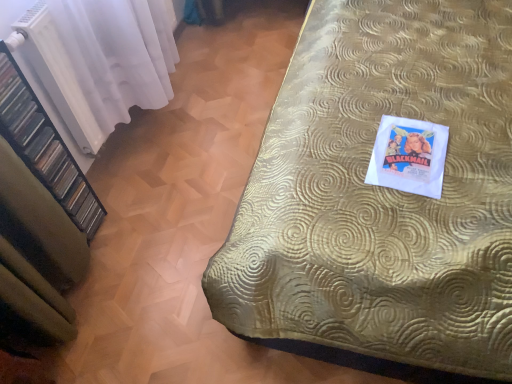
Measure the distance between white sheer curtain at left and camera.

white sheer curtain at left is 1.35 meters away from camera.

What do you see at coordinates (100, 60) in the screenshot? The width and height of the screenshot is (512, 384). I see `white sheer curtain at left` at bounding box center [100, 60].

Find the location of a particular element. This screenshot has height=384, width=512. black plastic shelf at left is located at coordinates (44, 147).

Does white sheer curtain at left have a greater width compared to gold textured bedspread at upper right?

No.

Is white sheer curtain at left placed right next to gold textured bedspread at upper right?

No, white sheer curtain at left is not making contact with gold textured bedspread at upper right.

Who is smaller, white sheer curtain at left or gold textured bedspread at upper right?

Smaller between the two is white sheer curtain at left.

Identify the location of bed below the white sheer curtain at left (from a real-world perspective). The image size is (512, 384). (382, 193).

In the scene shown: Considering the sizes of objects gold textured bedspread at upper right and white sheer curtain at left in the image provided, who is taller, gold textured bedspread at upper right or white sheer curtain at left?

With more height is white sheer curtain at left.

Is white sheer curtain at left a part of gold textured bedspread at upper right?

No, gold textured bedspread at upper right does not contain white sheer curtain at left.

Based on the photo, is gold textured bedspread at upper right wider than white sheer curtain at left?

Yes, gold textured bedspread at upper right is wider than white sheer curtain at left.

The image size is (512, 384). I want to click on curtain located on the left of gold textured bedspread at upper right, so click(100, 60).

Is black plastic shelf at left facing away from white sheer curtain at left?

That's not correct — black plastic shelf at left is not looking away from white sheer curtain at left.

Which object is positioned more to the left, black plastic shelf at left or white sheer curtain at left?

Positioned to the left is black plastic shelf at left.

Are black plastic shelf at left and white sheer curtain at left located far from each other?

That's not correct — black plastic shelf at left is a little close to white sheer curtain at left.

From the image's perspective, is white sheer curtain at left above or below black plastic shelf at left?

white sheer curtain at left is above black plastic shelf at left.

Based on the photo, can you tell me how much white sheer curtain at left and black plastic shelf at left differ in facing direction?

There is a 0.00177-degree angle between the facing directions of white sheer curtain at left and black plastic shelf at left.

Is white sheer curtain at left oriented away from black plastic shelf at left?

No, white sheer curtain at left's orientation is not away from black plastic shelf at left.

Where is `shelf that appears in front of the white sheer curtain at left`? The height and width of the screenshot is (384, 512). shelf that appears in front of the white sheer curtain at left is located at coordinates (44, 147).

Would you say black plastic shelf at left is to the left or to the right of gold textured bedspread at upper right in the picture?

Clearly, black plastic shelf at left is on the left of gold textured bedspread at upper right in the image.

From the image's perspective, is black plastic shelf at left located beneath gold textured bedspread at upper right?

Indeed, from the image's perspective, black plastic shelf at left is shown beneath gold textured bedspread at upper right.

Is black plastic shelf at left oriented towards gold textured bedspread at upper right?

No.

Considering the sizes of gold textured bedspread at upper right and black plastic shelf at left in the image, is gold textured bedspread at upper right wider or thinner than black plastic shelf at left?

Considering their sizes, gold textured bedspread at upper right looks broader than black plastic shelf at left.

From a real-world perspective, is gold textured bedspread at upper right physically below black plastic shelf at left?

Yes, from a real-world perspective, gold textured bedspread at upper right is below black plastic shelf at left.

Could you tell me if gold textured bedspread at upper right is turned towards black plastic shelf at left?

No, gold textured bedspread at upper right is not oriented towards black plastic shelf at left.

Is gold textured bedspread at upper right further to camera compared to black plastic shelf at left?

Yes, it is.

I want to click on bed on the right of white sheer curtain at left, so click(382, 193).

The image size is (512, 384). Find the location of `bed beneath the white sheer curtain at left (from a real-world perspective)`. bed beneath the white sheer curtain at left (from a real-world perspective) is located at coordinates (382, 193).

Consider the image. When comparing their distances from black plastic shelf at left, does gold textured bedspread at upper right or white sheer curtain at left seem closer?

white sheer curtain at left.

Estimate the real-world distances between objects in this image. Which object is further from gold textured bedspread at upper right, white sheer curtain at left or black plastic shelf at left?

black plastic shelf at left is positioned further to the anchor gold textured bedspread at upper right.

Considering their positions, is white sheer curtain at left positioned closer to black plastic shelf at left than gold textured bedspread at upper right?

white sheer curtain at left lies closer to black plastic shelf at left than the other object.

Looking at the image, which one is located closer to white sheer curtain at left, gold textured bedspread at upper right or black plastic shelf at left?

black plastic shelf at left is positioned closer to the anchor white sheer curtain at left.

From the image, which object appears to be nearer to white sheer curtain at left, black plastic shelf at left or gold textured bedspread at upper right?

Among the two, black plastic shelf at left is located nearer to white sheer curtain at left.

From the picture: When comparing their distances from gold textured bedspread at upper right, does black plastic shelf at left or white sheer curtain at left seem closer?

white sheer curtain at left lies closer to gold textured bedspread at upper right than the other object.

Locate an element on the screen. The width and height of the screenshot is (512, 384). curtain situated between black plastic shelf at left and gold textured bedspread at upper right from left to right is located at coordinates (100, 60).